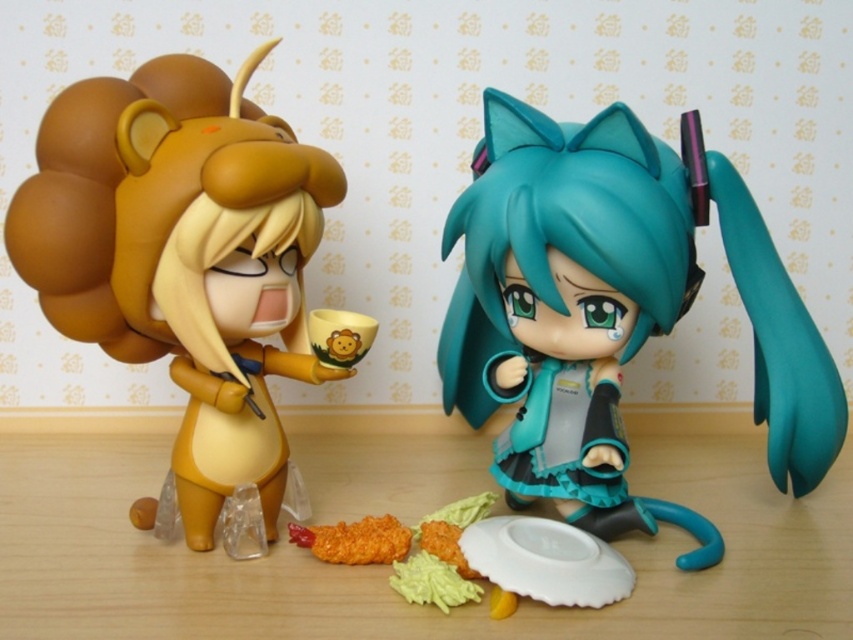
You are a chef preparing a dish and need to place both the teal glossy hair at center and the yellow matte mashed potato at lower center on a small plate. Based on their sizes, which one should you place first to ensure they both fit?

The yellow matte mashed potato at lower center should be placed first because the teal glossy hair at center might be wider, so placing the smaller one first allows adjusting space for the wider object.

You are a photographer setting up a shot of the two figurines on the wooden surface. You want to focus on the point at coordinates point [375,563]. Given that the camera can only focus on objects within 30 inches, will this point be in focus?

The point [375,563] is 35.54 inches away from the camera, which is beyond the camera focus range of 30 inches. Therefore, the point will not be in focus.

You are a chef preparing a dish and see the teal glossy hair at center and the yellow matte mashed potato at lower center in your kitchen. Which item is closer to you?

The teal glossy hair at center is closer to you because the yellow matte mashed potato at lower center is behind it.